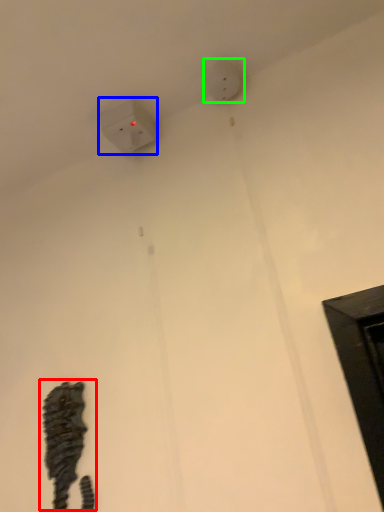
Question: Considering the real-world distances, which object is closest to animal (highlighted by a red box)? power plugs and sockets (highlighted by a blue box) or electric outlet (highlighted by a green box).

Choices:
 (A) power plugs and sockets
 (B) electric outlet

Answer: (A)